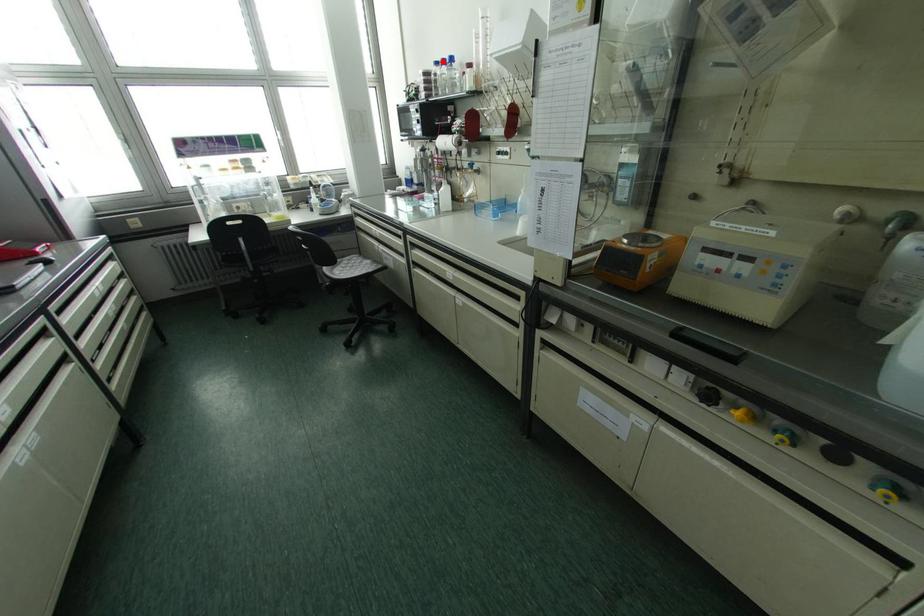
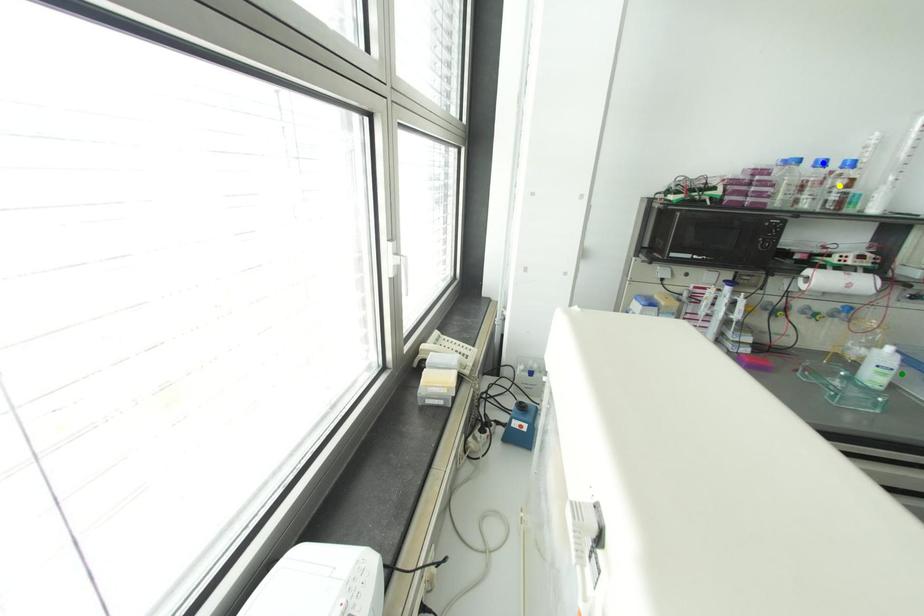
Question: I am providing you with two images of the same scene from different viewpoints. A red point is marked on the first image. You are given multiple points on the second image. Which mark in image 2 goes with the point in image 1?

Choices:
 (A) blue point
 (B) yellow point
 (C) green point

Answer: (A)